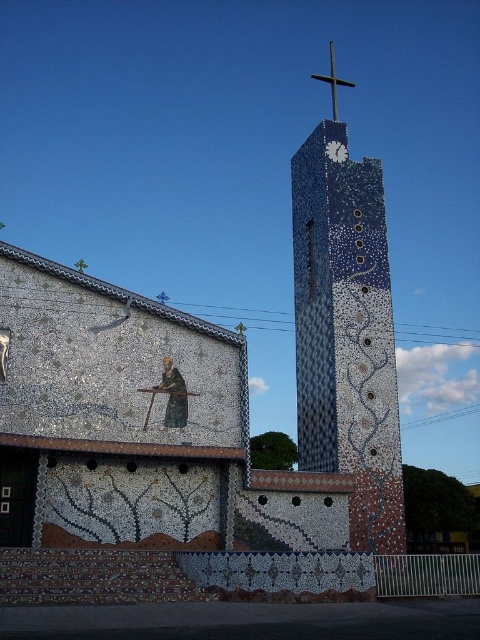
You are an architect assessing the church tower. You notice the metallic cross at upper center and the white mosaic clock at upper center. Which object is wider according to the spatial details?

The metallic cross at upper center is wider than the white mosaic clock at upper center according to the spatial details.

Based on the scene description, where is the metallic cross at upper center located in terms of coordinates?

The metallic cross at upper center is located at point coordinates of (333, 81).

You are an architect evaluating the church design. You notice the metallic cross at upper center and the white mosaic clock at upper center. Which object has a larger size according to the design specifications?

The metallic cross at upper center is bigger than the white mosaic clock at upper center, so the metallic cross at upper center has a larger size according to the design specifications.